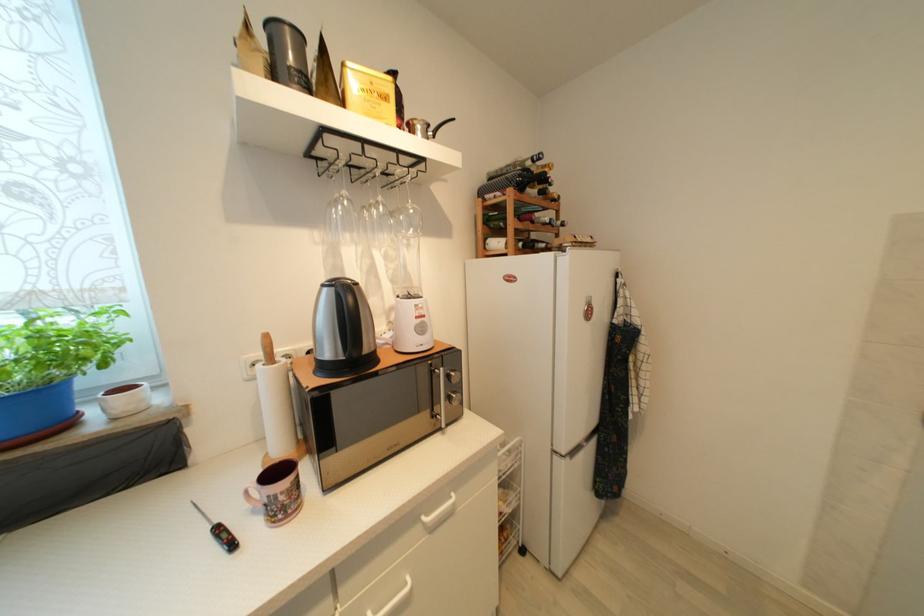
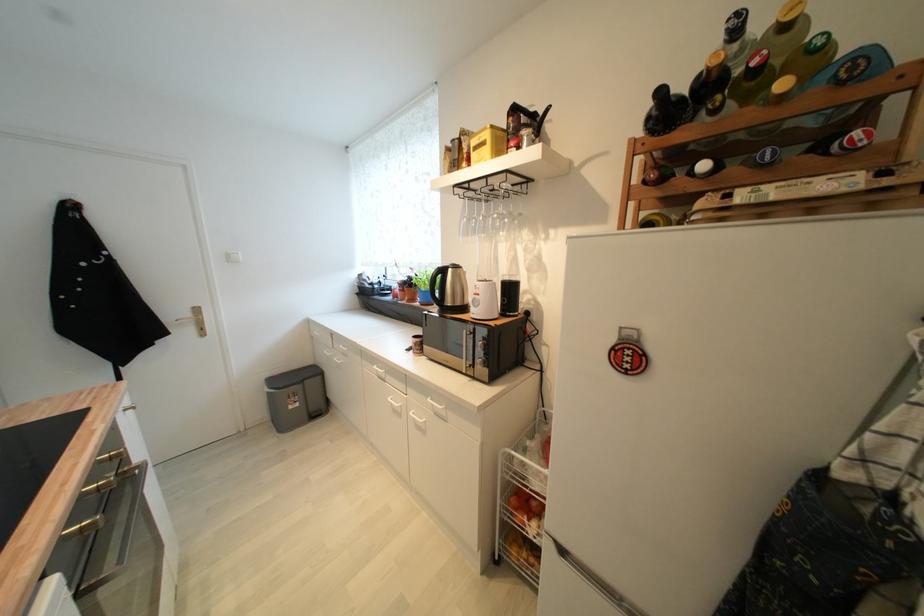
Locate, in the second image, the point that corresponds to [429,318] in the first image.

(483, 296)